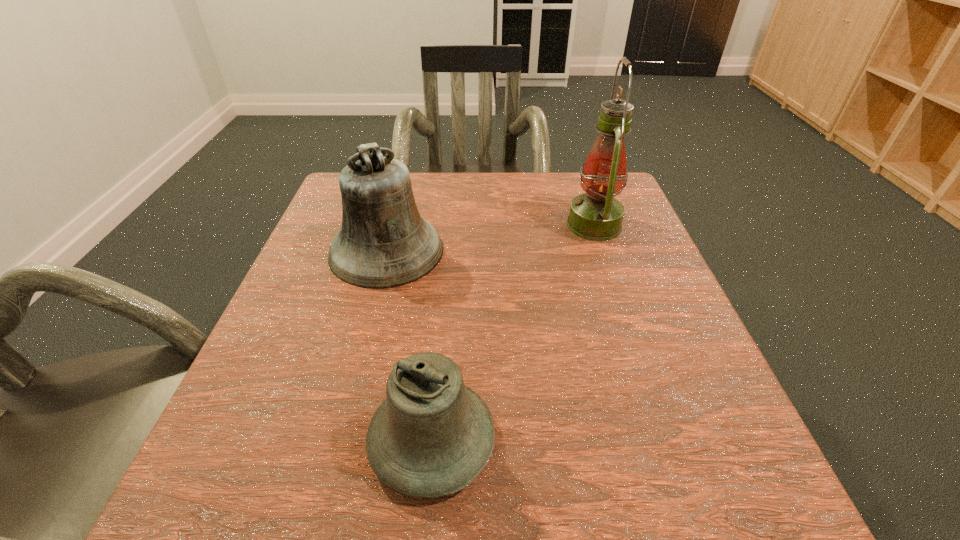
I want to click on bell present at the far edge, so click(x=383, y=243).

Find the location of a particular element. The width and height of the screenshot is (960, 540). object that is at the near edge is located at coordinates (432, 436).

Find the location of a particular element. This screenshot has width=960, height=540. object at the left edge is located at coordinates [x=383, y=243].

Identify the location of object present at the right edge. This screenshot has width=960, height=540. (596, 215).

At what (x,y) coordinates should I click in order to perform the action: click on object that is at the far left corner. Please return your answer as a coordinate pair (x, y). Image resolution: width=960 pixels, height=540 pixels. Looking at the image, I should click on (383, 243).

This screenshot has width=960, height=540. Identify the location of object at the far right corner. (596, 215).

The image size is (960, 540). In the image, there is a desktop. Identify the location of vacant region at the far edge. (524, 203).

The height and width of the screenshot is (540, 960). In the image, there is a desktop. In order to click on vacant region at the near edge in this screenshot , I will do `click(534, 462)`.

Image resolution: width=960 pixels, height=540 pixels. In the image, there is a desktop. Identify the location of vacant space at the left edge. (325, 239).

At what (x,y) coordinates should I click in order to perform the action: click on vacant space at the right edge of the desktop. Please return your answer as a coordinate pair (x, y). Looking at the image, I should click on (632, 288).